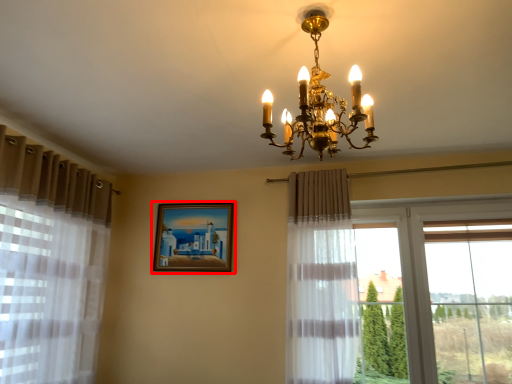
Question: From the image's perspective, where is picture frame (annotated by the red box) located in relation to lamp in the image?

Choices:
 (A) below
 (B) above

Answer: (A)